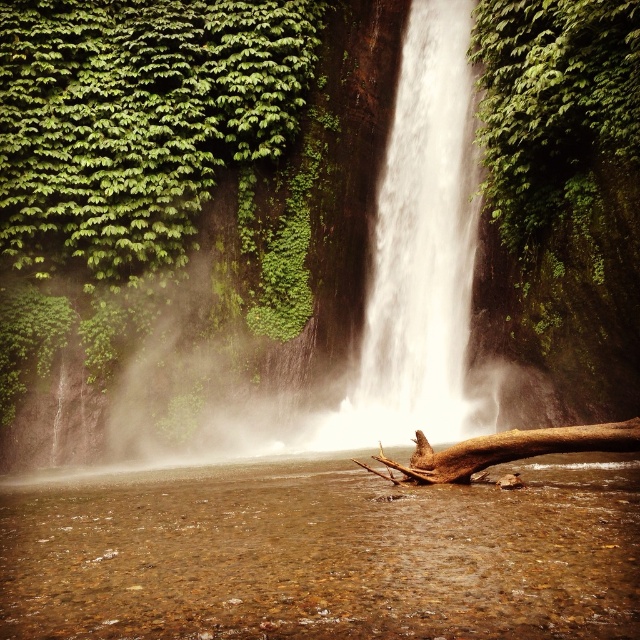
You are standing at the base of the waterfall and want to reach a hidden treasure located at point (x=440, y=454). There is an obstacle at point (x=428, y=310) blocking your path. Can you safely walk around the obstacle to reach the treasure without crossing it?

Point (x=428, y=310) is behind point (x=440, y=454), so you can safely walk around the obstacle to reach the treasure without crossing it.

Consider the image. You are a hiker who wants to cross the brown rough tree trunk at lower center to reach the other side. Considering the brown textured water at center, is the tree trunk submerged enough to make crossing dangerous?

The brown textured water at center is much taller than the brown rough tree trunk at lower center, which means the tree trunk is mostly submerged in the water. This could make crossing dangerous due to reduced stability and visibility of the trunk.

You are standing at the base of the waterfall and want to take a photo of both the green leafy tree at upper left and the white smooth waterfall at center. Which object should you position to the left side of your camera frame?

The green leafy tree at upper left should be positioned to the left side of your camera frame since it is located to the left of the white smooth waterfall at center.